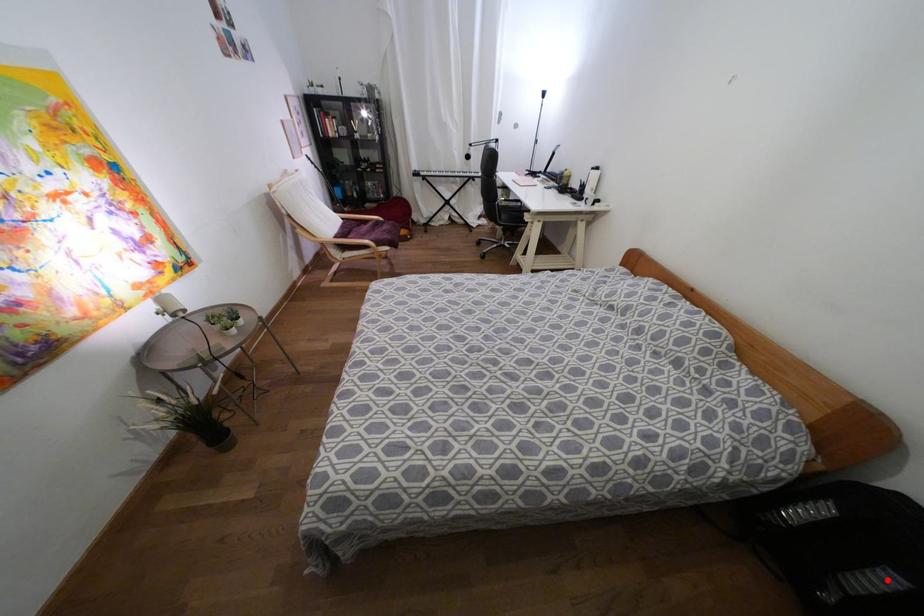
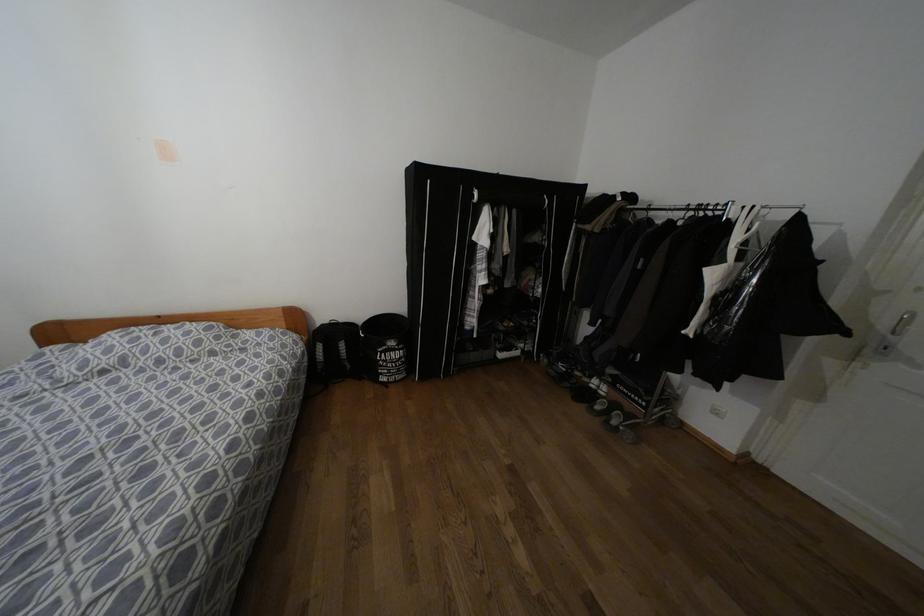
The point at the highlighted location is marked in the first image. Where is the corresponding point in the second image?

(342, 345)